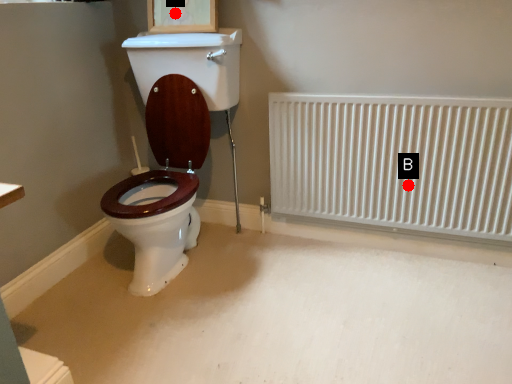
Question: Two points are circled on the image, labeled by A and B beside each circle. Which point is further to the camera?

Choices:
 (A) A is further
 (B) B is further

Answer: (A)